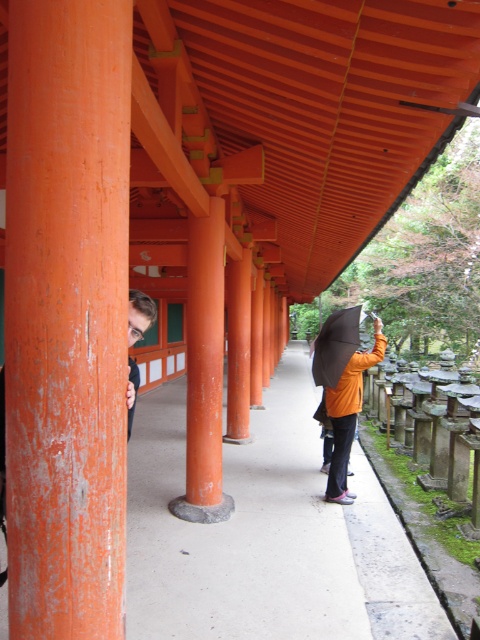
Does smooth concrete path at center have a lesser width compared to black matte umbrella at center?

No.

Can you confirm if smooth concrete path at center is positioned below black matte umbrella at center?

Yes, smooth concrete path at center is below black matte umbrella at center.

Which is behind, point (256, 499) or point (334, 346)?

The point (256, 499) is behind.

Find the location of `smooth concrete path at center`. smooth concrete path at center is located at coordinates click(267, 536).

Find the location of a particular element. smooth orange wood pillar at left is located at coordinates (67, 316).

Does smooth orange wood pillar at left have a greater width compared to smooth concrete path at center?

No, smooth orange wood pillar at left is not wider than smooth concrete path at center.

Between point (25, 129) and point (255, 625), which one is positioned behind?

The point (255, 625) is behind.

This screenshot has height=640, width=480. What are the coordinates of `smooth orange wood pillar at left` in the screenshot? It's located at (x=67, y=316).

Can you confirm if orange matte jacket at center is taller than black matte umbrella at center?

Yes, orange matte jacket at center is taller than black matte umbrella at center.

Which is in front, point (334, 412) or point (343, 330)?

Positioned in front is point (334, 412).

I want to click on orange matte jacket at center, so click(348, 413).